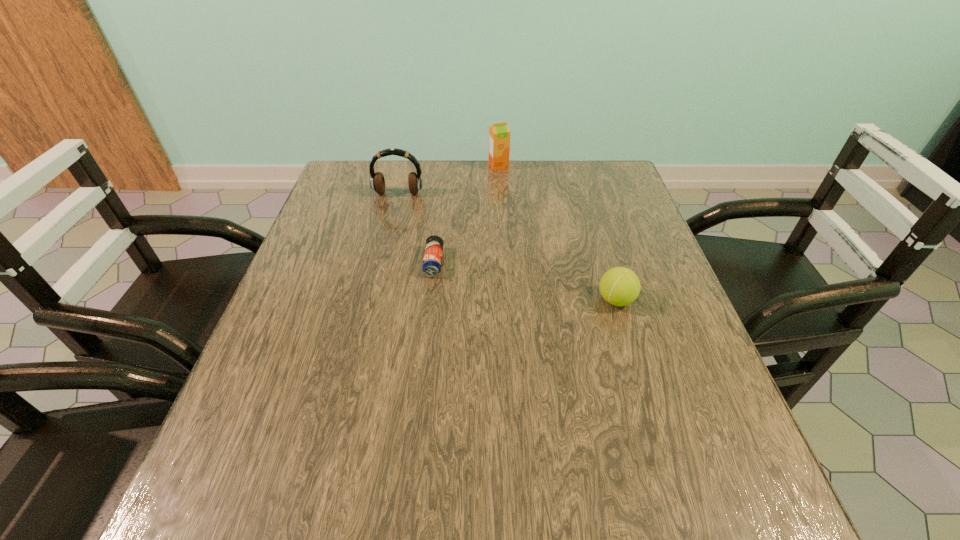
Identify the location of free space located 0.370m on the left of the nearest object. (422, 300).

Identify the location of blank space located on the right of the beer can. (477, 262).

Locate an element on the screen. This screenshot has width=960, height=540. orange juice that is at the far edge is located at coordinates (499, 134).

The height and width of the screenshot is (540, 960). Find the location of `headset positioned at the far edge`. headset positioned at the far edge is located at coordinates (377, 182).

Find the location of a particular element. This screenshot has height=540, width=960. object present at the left edge is located at coordinates (377, 182).

Identify the location of object positioned at the right edge. (619, 286).

You are a GUI agent. You are given a task and a screenshot of the screen. Output one action in this format:
    pyautogui.click(x=<x>, y=<y>)
    Task: Click on the object at the far left corner
    
    Given the screenshot: What is the action you would take?
    pyautogui.click(x=377, y=182)

The image size is (960, 540). In order to click on vacant space at the far edge of the desktop in this screenshot , I will do `click(530, 198)`.

Where is `vacant area at the near edge of the desktop`? vacant area at the near edge of the desktop is located at coordinates (349, 484).

The image size is (960, 540). In the image, there is a desktop. What are the coordinates of `vacant space at the left edge` in the screenshot? It's located at (271, 364).